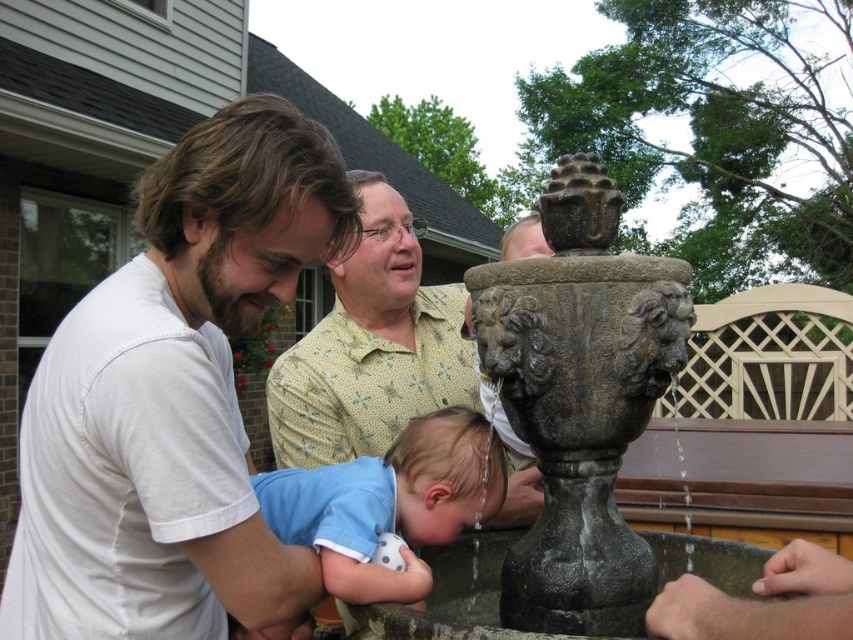
Question: Does white cotton shirt at upper left have a smaller size compared to blue cotton shirt at center?

Choices:
 (A) yes
 (B) no

Answer: (B)

Question: Which point is farther to the camera?

Choices:
 (A) white cotton shirt at upper left
 (B) blue cotton shirt at center

Answer: (B)

Question: Which point appears closest to the camera in this image?

Choices:
 (A) (815, 554)
 (B) (347, 564)
 (C) (244, 237)

Answer: (A)

Question: Is blue cotton shirt at center thinner than smooth gray hand at lower right?

Choices:
 (A) yes
 (B) no

Answer: (B)

Question: Which point appears farthest from the camera in this image?

Choices:
 (A) (592, 410)
 (B) (679, 596)

Answer: (A)

Question: Does stone fountain at center come in front of blue cotton shirt at center?

Choices:
 (A) yes
 (B) no

Answer: (A)